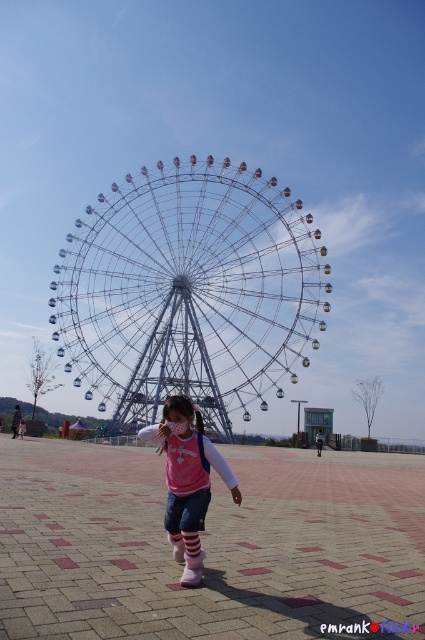
Based on the photo, you are standing at the base of the Ferris wheel and see the point marked at coordinates [190,394]. If you want to reach that point quickly, should you walk towards the Ferris wheel or away from it?

The point at [190,394] is 132.07 meters away from you. Since you are at the base of the Ferris wheel, walking towards the Ferris wheel would bring you closer to the point, so you should walk towards the Ferris wheel to reach it quickly.

You are a photographer standing at the Ferris wheel and see the pink fabric shirt at center and the white matte sock at center. Which clothing item is higher up in the image?

The pink fabric shirt at center is taller than the white matte sock at center, so the pink fabric shirt at center is higher up in the image.

You are a photographer trying to capture the entire Ferris wheel and the girl in one shot. Given that the metallic wire Ferris wheel at center is larger than the pink fabric shirt at center, which object should you focus on first to ensure both are in frame?

Since the metallic wire Ferris wheel at center is bigger than the pink fabric shirt at center, you should focus on the metallic wire Ferris wheel at center first to ensure it fits in the frame, then adjust to include the pink fabric shirt at center.